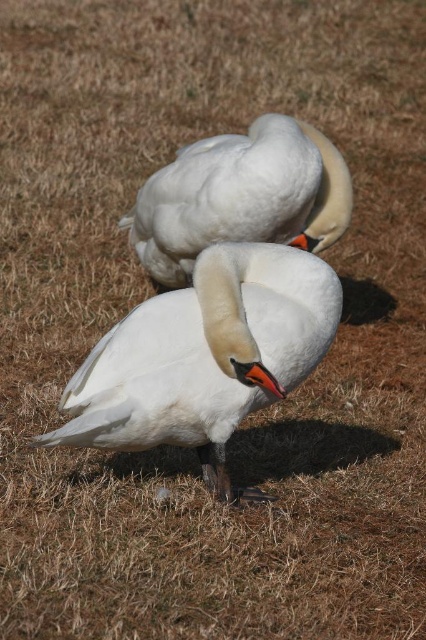
You are a wildlife photographer aiming to capture a clear photo of both swans. Since the white glossy swan at center and the white matte swan at center are both at center, which one is more likely to be in focus if you focus on the center of the image?

The white glossy swan at center is taller than the white matte swan at center, so focusing on the center would likely keep the white glossy swan at center in focus more prominently.

You are a photographer trying to capture both swans in a single shot. Since the white glossy swan at center and the white matte swan at center are both in the frame, which one will appear more in focus in your photo?

The white glossy swan at center will appear more in focus because it is closer to the viewer than the white matte swan at center, which is further away.